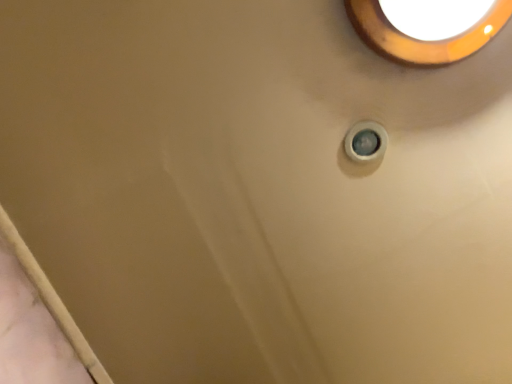
Question: From the image's perspective, is matte orange light fixture at upper right located above white plastic knob at upper right?

Choices:
 (A) yes
 (B) no

Answer: (A)

Question: From a real-world perspective, is matte orange light fixture at upper right over white plastic knob at upper right?

Choices:
 (A) no
 (B) yes

Answer: (A)

Question: Is matte orange light fixture at upper right facing towards white plastic knob at upper right?

Choices:
 (A) yes
 (B) no

Answer: (B)

Question: Considering the relative sizes of matte orange light fixture at upper right and white plastic knob at upper right in the image provided, is matte orange light fixture at upper right wider than white plastic knob at upper right?

Choices:
 (A) no
 (B) yes

Answer: (B)

Question: Are matte orange light fixture at upper right and white plastic knob at upper right located far from each other?

Choices:
 (A) no
 (B) yes

Answer: (A)

Question: Is matte orange light fixture at upper right at the left side of white plastic knob at upper right?

Choices:
 (A) yes
 (B) no

Answer: (B)

Question: Does white plastic knob at upper right have a lesser height compared to matte orange light fixture at upper right?

Choices:
 (A) no
 (B) yes

Answer: (B)

Question: Can you confirm if white plastic knob at upper right is thinner than matte orange light fixture at upper right?

Choices:
 (A) no
 (B) yes

Answer: (B)

Question: Are white plastic knob at upper right and matte orange light fixture at upper right beside each other?

Choices:
 (A) yes
 (B) no

Answer: (B)

Question: From the image's perspective, does white plastic knob at upper right appear lower than matte orange light fixture at upper right?

Choices:
 (A) yes
 (B) no

Answer: (A)

Question: Is white plastic knob at upper right bigger than matte orange light fixture at upper right?

Choices:
 (A) yes
 (B) no

Answer: (B)

Question: Does white plastic knob at upper right have a greater width compared to matte orange light fixture at upper right?

Choices:
 (A) yes
 (B) no

Answer: (B)

Question: Is point (356, 152) closer or farther from the camera than point (364, 28)?

Choices:
 (A) farther
 (B) closer

Answer: (A)